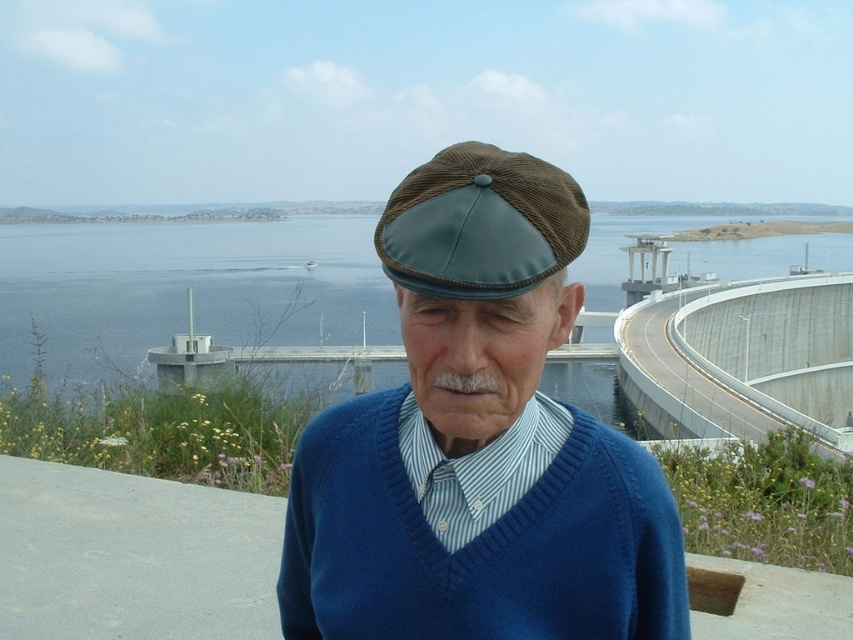
Describe the element at coordinates (183, 289) in the screenshot. I see `blue water at center` at that location.

Can you confirm if blue water at center is shorter than blue knitted sweater at center?

No.

Is point (608, 276) closer to viewer compared to point (109, 481)?

No, it is behind (109, 481).

Where is `blue water at center`? blue water at center is located at coordinates (183, 289).

Between blue knitted sweater at center and brown corduroy cap at center, which one appears on the right side from the viewer's perspective?

brown corduroy cap at center

Can you confirm if blue knitted sweater at center is positioned to the left of brown corduroy cap at center?

Indeed, blue knitted sweater at center is positioned on the left side of brown corduroy cap at center.

Is point (798, 627) closer to camera compared to point (457, 269)?

That is False.

The image size is (853, 640). I want to click on blue knitted sweater at center, so click(x=132, y=556).

Does concrete at right have a lesser width compared to brown corduroy cap at center?

Incorrect, concrete at right's width is not less than brown corduroy cap at center's.

Is concrete at right further to camera compared to brown corduroy cap at center?

Yes, concrete at right is further from the viewer.

Describe the element at coordinates (735, 355) in the screenshot. I see `concrete at right` at that location.

I want to click on concrete at right, so click(x=735, y=355).